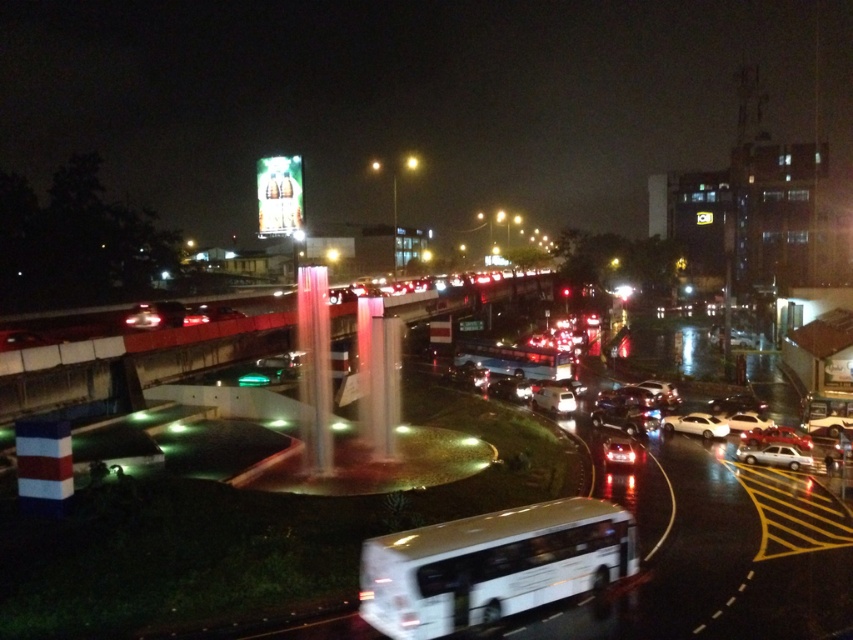
Question: Which object appears farthest from the camera in this image?

Choices:
 (A) white glossy sedan at center
 (B) white matte bus at center
 (C) shiny red sedan at center
 (D) white glossy sedan at lower right

Answer: (B)

Question: Is white glossy sedan at center to the right of shiny red sedan at center from the viewer's perspective?

Choices:
 (A) yes
 (B) no

Answer: (B)

Question: Can you confirm if white glossy bus at center is positioned to the right of white matte bus at center?

Choices:
 (A) no
 (B) yes

Answer: (A)

Question: Is white glossy bus at center below glossy white car at lower center?

Choices:
 (A) yes
 (B) no

Answer: (B)

Question: Which of the following is the closest to the observer?

Choices:
 (A) shiny red sedan at center
 (B) white matte bus at center
 (C) glossy white car at lower center

Answer: (C)

Question: Estimate the real-world distances between objects in this image. Which object is farther from the white glossy sedan at lower right?

Choices:
 (A) white glossy sedan at center
 (B) white matte bus at center
 (C) glossy white car at lower center

Answer: (B)